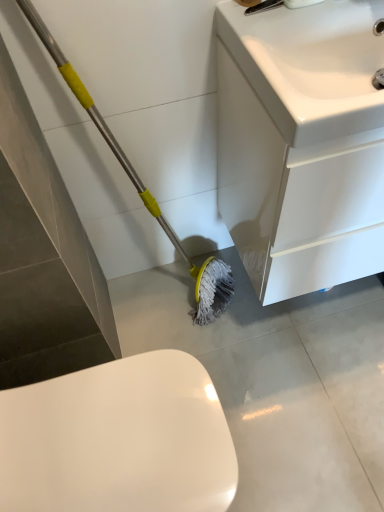
Identify the location of vacant space situated above white glossy toilet at lower left (from a real-world perspective). The image size is (384, 512). (86, 445).